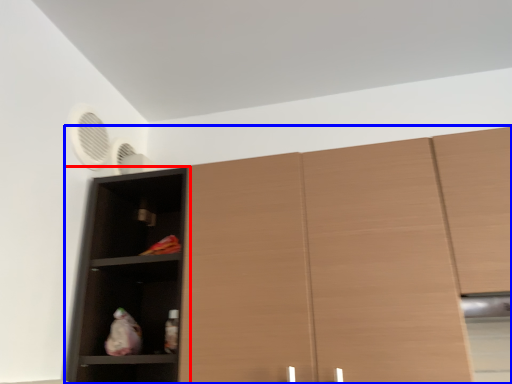
Question: Among these objects, which one is farthest to the camera, shelf (highlighted by a red box) or cupboard (highlighted by a blue box)?

Choices:
 (A) shelf
 (B) cupboard

Answer: (A)